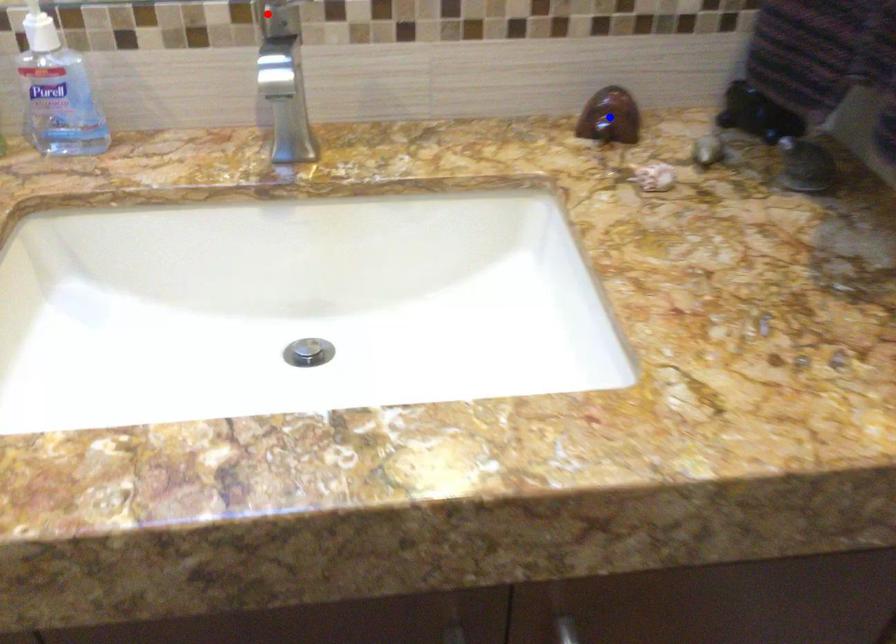
Question: In the image, two points are highlighted. Which point is nearer to the camera? Reply with the corresponding letter.

Choices:
 (A) blue point
 (B) red point

Answer: (B)